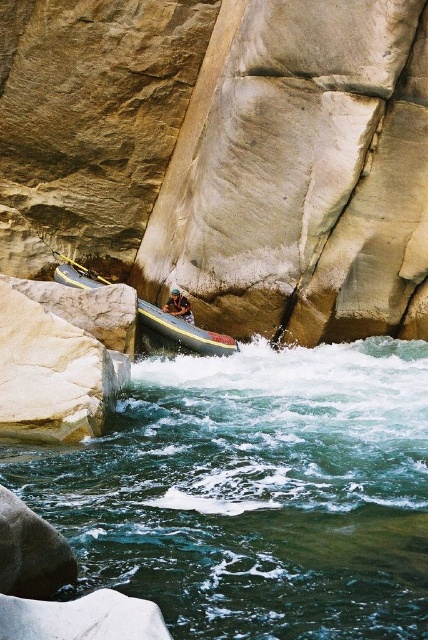
Does rubber boat at center have a larger size compared to brown leather helmet at center?

Correct, rubber boat at center is larger in size than brown leather helmet at center.

Does rubber boat at center have a greater height compared to brown leather helmet at center?

Yes, rubber boat at center is taller than brown leather helmet at center.

This screenshot has height=640, width=428. I want to click on rubber boat at center, so click(x=184, y=332).

Which of these two, brown leather helmet at center or yellow plastic paddle at center, stands taller?

brown leather helmet at center is taller.

Between brown leather helmet at center and yellow plastic paddle at center, which one has less height?

With less height is yellow plastic paddle at center.

Who is more forward, (175, 298) or (74, 260)?

Positioned in front is point (175, 298).

Identify the location of brown leather helmet at center. The width and height of the screenshot is (428, 640). (178, 307).

Is white smooth rock at center to the left of yellow plastic paddle at center from the viewer's perspective?

Incorrect, white smooth rock at center is not on the left side of yellow plastic paddle at center.

Between white smooth rock at center and yellow plastic paddle at center, which one appears on the right side from the viewer's perspective?

From the viewer's perspective, white smooth rock at center appears more on the right side.

Based on the photo, measure the distance between point (32,374) and camera.

The distance of point (32,374) from camera is 17.77 meters.

I want to click on white smooth rock at center, so tap(59, 356).